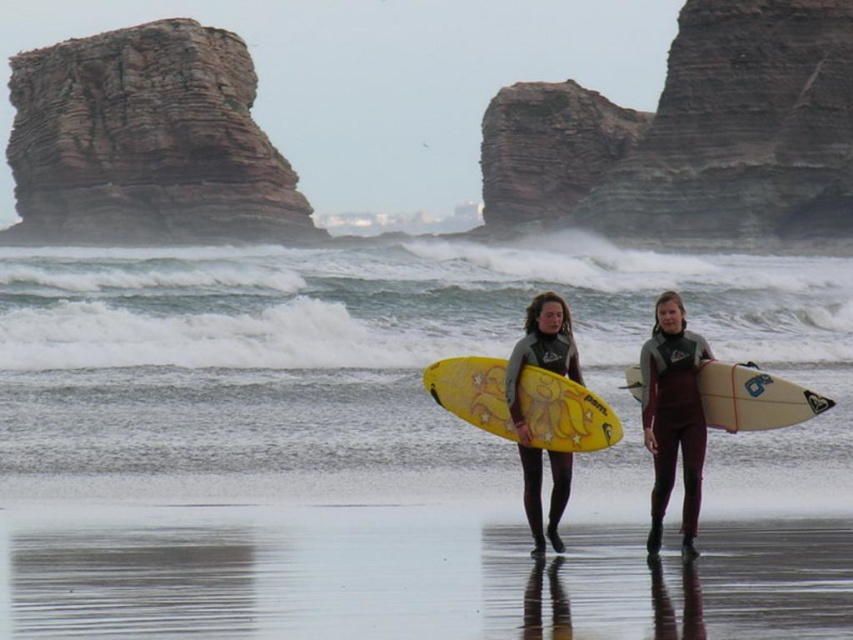
Is gray matte wetsuit at center bigger than maroon neoprene wetsuit at center?

Yes, gray matte wetsuit at center is bigger than maroon neoprene wetsuit at center.

Between point (665, 506) and point (671, 396), which one is positioned in front?

Point (665, 506)

Identify the location of gray matte wetsuit at center. (675, 420).

Can you confirm if maroon neoprene wetsuit at center is positioned above white glossy surfboard at center?

Actually, maroon neoprene wetsuit at center is below white glossy surfboard at center.

Is maroon neoprene wetsuit at center closer to the viewer compared to white glossy surfboard at center?

Yes, maroon neoprene wetsuit at center is in front of white glossy surfboard at center.

Image resolution: width=853 pixels, height=640 pixels. Identify the location of maroon neoprene wetsuit at center. point(672,416).

Which is behind, point (569, 195) or point (672, 392)?

Positioned behind is point (569, 195).

Is brown rough rock at upper center positioned in front of gray matte wetsuit at center?

That is False.

Which is behind, point (727, 157) or point (517, 420)?

The point (727, 157) is behind.

You are a GUI agent. You are given a task and a screenshot of the screen. Output one action in this format:
    pyautogui.click(x=<x>, y=<y>)
    Task: Click on the brown rough rock at upper center
    
    Given the screenshot: What is the action you would take?
    pyautogui.click(x=691, y=134)